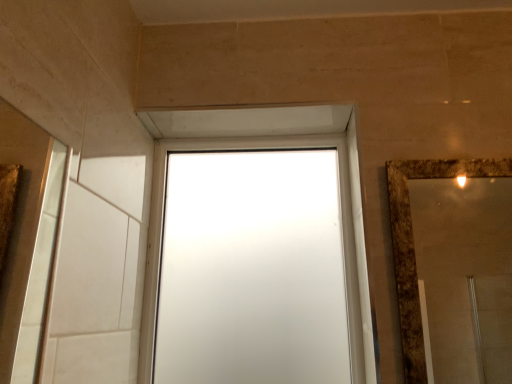
What is the approximate width of frosted glass window at center?

5.46 centimeters.

This screenshot has width=512, height=384. Identify the location of frosted glass window at center. (351, 239).

Measure the distance between frosted glass window at center and camera.

They are 86.95 centimeters apart.

This screenshot has width=512, height=384. What do you see at coordinates (351, 239) in the screenshot?
I see `frosted glass window at center` at bounding box center [351, 239].

Identify the location of frosted glass window at center. (351, 239).